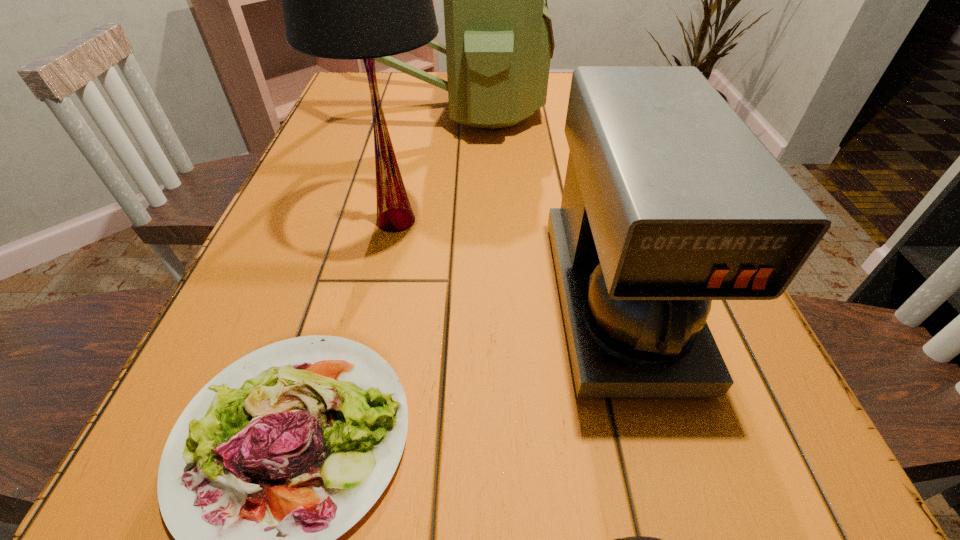
At what (x,y) coordinates should I click in order to perform the action: click on backpack. Please return your answer as a coordinate pair (x, y). This screenshot has height=540, width=960. Looking at the image, I should click on (499, 39).

Where is `lampshade`? lampshade is located at coordinates (348, 0).

Locate an element on the screen. The image size is (960, 540). the third shortest object is located at coordinates (670, 201).

Find the location of a particular element. free space located 0.230m on the front pocket of the backpack is located at coordinates (630, 111).

You are a GUI agent. You are given a task and a screenshot of the screen. Output one action in this format:
    pyautogui.click(x=<x>, y=<y>)
    Task: Click on the vacant space located 0.300m on the front-facing side of the lampshade
    The width and height of the screenshot is (960, 540).
    Given the screenshot: What is the action you would take?
    pyautogui.click(x=607, y=220)

Locate an element on the screen. free space located on the carafe side of the coffee maker is located at coordinates (660, 447).

Locate an element on the screen. The height and width of the screenshot is (540, 960). object located in the far edge section of the desktop is located at coordinates (499, 39).

The height and width of the screenshot is (540, 960). Find the location of `backpack at the left edge`. backpack at the left edge is located at coordinates pyautogui.click(x=499, y=39).

Where is `lampshade that is positioned at the left edge`? The image size is (960, 540). lampshade that is positioned at the left edge is located at coordinates (348, 0).

At what (x,y) coordinates should I click in order to perform the action: click on object that is positioned at the right edge. Please return your answer as a coordinate pair (x, y). The height and width of the screenshot is (540, 960). Looking at the image, I should click on (670, 201).